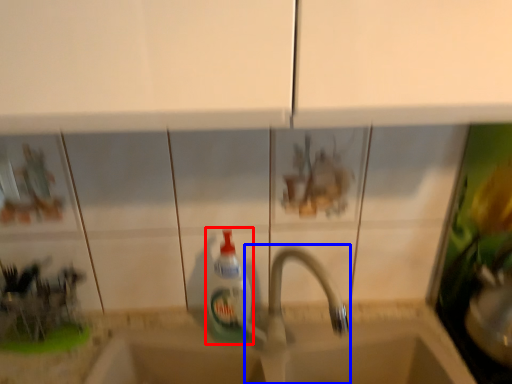
Question: Which object is further to the camera taking this photo, bottle (highlighted by a red box) or tap (highlighted by a blue box)?

Choices:
 (A) bottle
 (B) tap

Answer: (A)